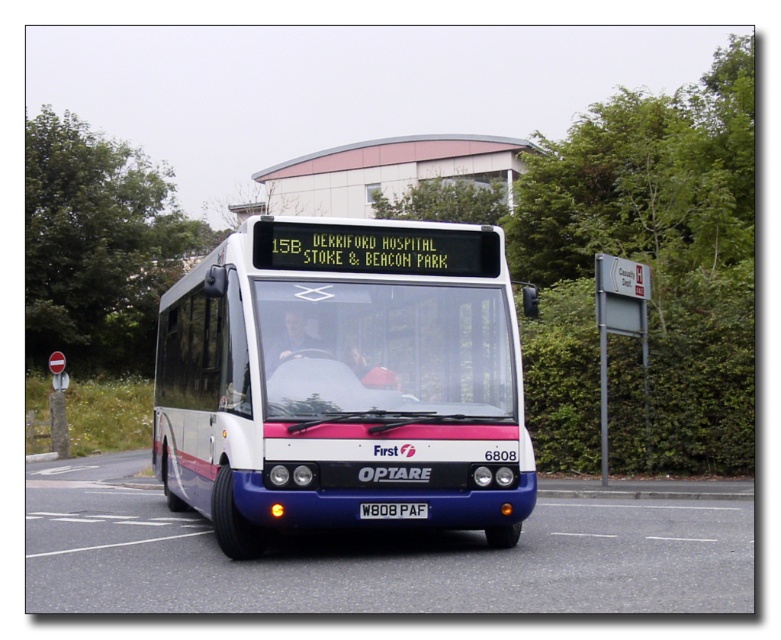
Who is positioned more to the right, metal sign at right or black plastic license plate at center?

metal sign at right is more to the right.

How far apart are metal sign at right and black plastic license plate at center?

They are 9.00 meters apart.

Is point (617, 308) less distant than point (423, 509)?

No, (617, 308) is behind (423, 509).

In order to click on metal sign at right in this screenshot , I will do `click(619, 326)`.

Between white glossy bus at center and metal sign at right, which one appears on the left side from the viewer's perspective?

white glossy bus at center is more to the left.

Image resolution: width=781 pixels, height=640 pixels. What do you see at coordinates (341, 381) in the screenshot?
I see `white glossy bus at center` at bounding box center [341, 381].

The image size is (781, 640). What do you see at coordinates (341, 381) in the screenshot? I see `white glossy bus at center` at bounding box center [341, 381].

Find the location of a particular element. The width and height of the screenshot is (781, 640). white glossy bus at center is located at coordinates (341, 381).

Does white glossy bus at center appear on the left side of black plastic license plate at center?

In fact, white glossy bus at center is to the right of black plastic license plate at center.

Who is higher up, white glossy bus at center or black plastic license plate at center?

Positioned higher is white glossy bus at center.

This screenshot has height=640, width=781. What are the coordinates of `white glossy bus at center` in the screenshot? It's located at (341, 381).

The height and width of the screenshot is (640, 781). Find the location of `white glossy bus at center`. white glossy bus at center is located at coordinates (341, 381).